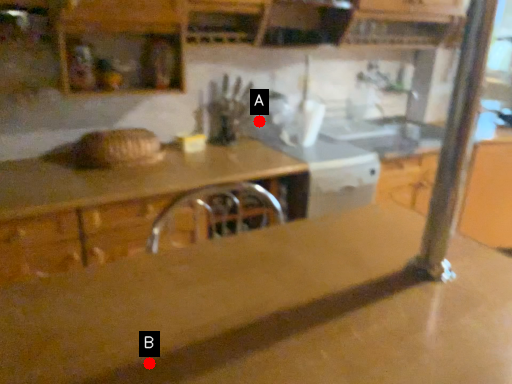
Question: Two points are circled on the image, labeled by A and B beside each circle. Which point appears farthest from the camera in this image?

Choices:
 (A) A is further
 (B) B is further

Answer: (A)